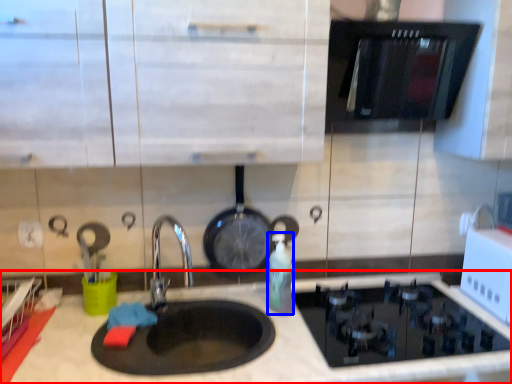
Question: Which object is further to the camera taking this photo, countertop (highlighted by a red box) or bottle (highlighted by a blue box)?

Choices:
 (A) countertop
 (B) bottle

Answer: (B)